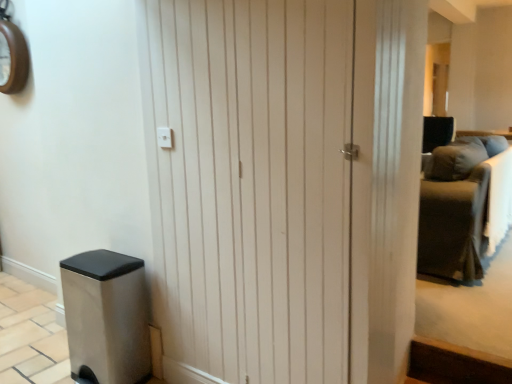
Question: Is white wood door at center taller or shorter than dark gray fabric couch at right?

Choices:
 (A) short
 (B) tall

Answer: (B)

Question: Based on their positions, is white wood door at center located to the left or right of dark gray fabric couch at right?

Choices:
 (A) left
 (B) right

Answer: (A)

Question: Which is farther from the wooden clock at upper left?

Choices:
 (A) white wood door at center
 (B) dark gray fabric couch at right

Answer: (B)

Question: Estimate the real-world distances between objects in this image. Which object is farther from the wooden clock at upper left?

Choices:
 (A) white wood door at center
 (B) dark gray fabric couch at right

Answer: (B)